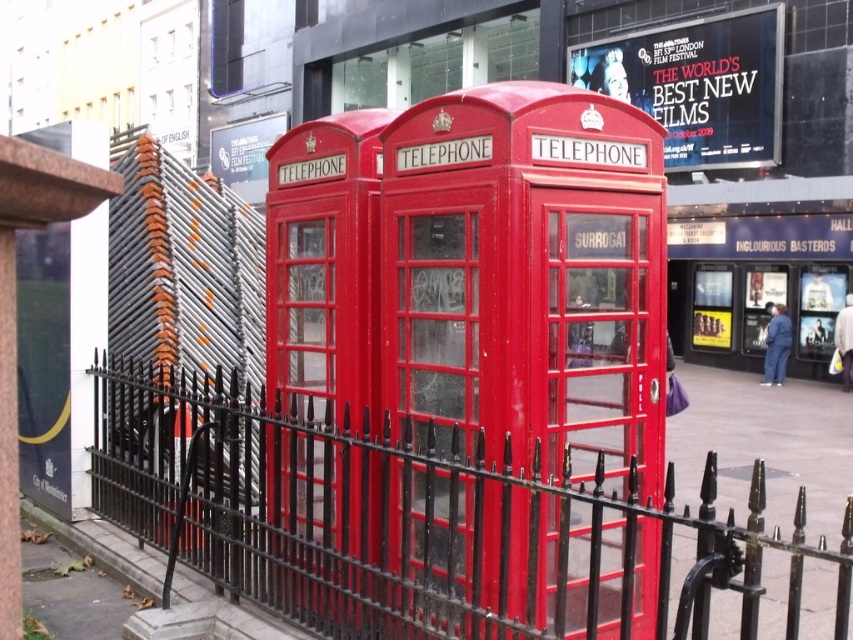
You are a film festival attendee walking towards the matte red telephone booth at center and the black wrought iron fence at lower left. Which object will you encounter first?

You will encounter the black wrought iron fence at lower left first because the matte red telephone booth at center is positioned to its right, meaning the fence is closer to your path.

You are a photographer trying to capture both the matte red telephone booth at center and the black wrought iron fence at lower left in a single frame. Given their sizes, which object will appear larger in your photo?

The black wrought iron fence at lower left will appear larger in the photo because it is bigger than the matte red telephone booth at center according to the description.

You are a delivery person trying to maneuver a 1.2 meter wide cart through the space between the matte red telephone booth at center and the black wrought iron fence at lower left. Based on their widths, can your cart fit through the gap if the total available space is the sum of both objects?

The matte red telephone booth at center has a lesser width compared to black wrought iron fence at lower left. However, since the total available space is the sum of both objects, we need to know the exact widths to determine if it can fit. Unfortunately, the description only states that the telephone booth is narrower but doesn not provide specific measurements. Therefore, it is impossible to determine if the 1.2 meter wide cart can fit through the gap based on the given information.